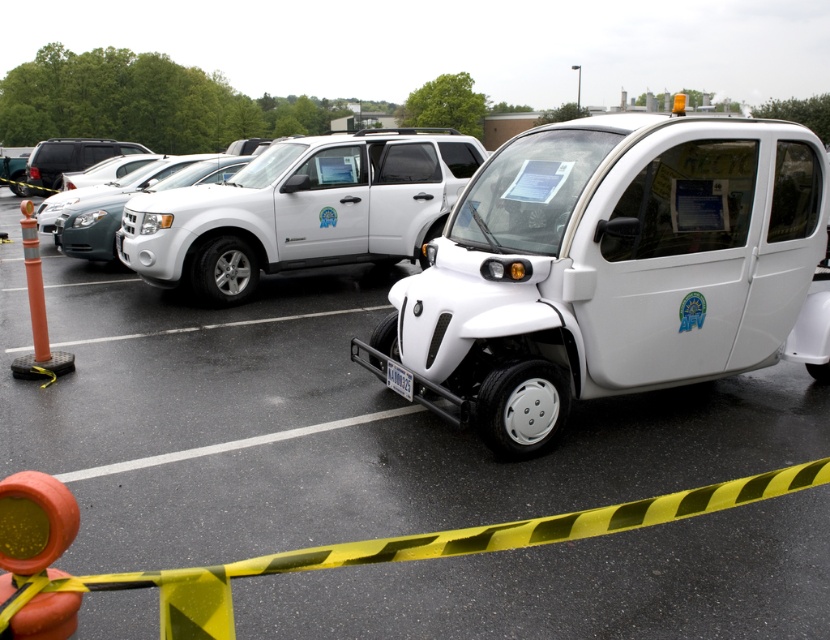
You are a parking attendant and need to locate the white matte electric car at center. According to the coordinates provided, where exactly is it positioned?

The white matte electric car at center is located at point (x=608, y=269).

You are standing in the parking lot and want to locate the point at coordinates (608, 269). Based on the scene description, which vehicle should you look for?

The point at coordinates (608, 269) is located on the white matte electric car at center.